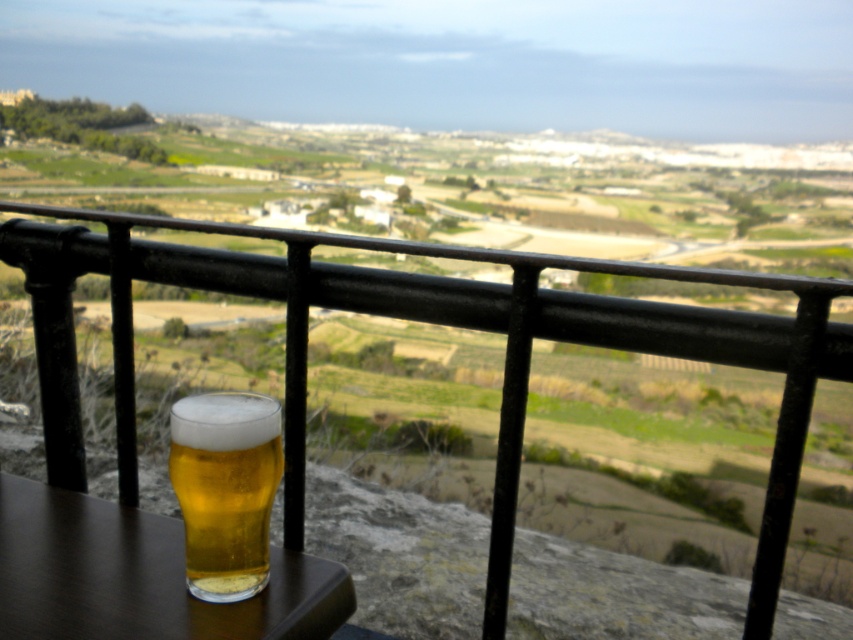
Who is lower down, black metal railing at upper center or golden glass beer at lower left?

golden glass beer at lower left is lower down.

Does black metal railing at upper center have a larger size compared to golden glass beer at lower left?

Yes, black metal railing at upper center is bigger than golden glass beer at lower left.

Who is more forward, (77, 212) or (189, 433)?

Point (189, 433) is in front.

The width and height of the screenshot is (853, 640). I want to click on black metal railing at upper center, so click(422, 321).

Does brown wood table at lower left have a greater height compared to golden glass beer at lower left?

No, brown wood table at lower left is not taller than golden glass beer at lower left.

Does point (10, 600) lie behind point (245, 509)?

Yes, it is.

This screenshot has height=640, width=853. What are the coordinates of `brown wood table at lower left` in the screenshot? It's located at (138, 577).

Which is more to the left, black metal railing at upper center or brown wood table at lower left?

brown wood table at lower left

Is black metal railing at upper center positioned in front of brown wood table at lower left?

No, it is not.

The height and width of the screenshot is (640, 853). I want to click on black metal railing at upper center, so click(x=422, y=321).

At what (x,y) coordinates should I click in order to perform the action: click on black metal railing at upper center. Please return your answer as a coordinate pair (x, y). This screenshot has width=853, height=640. Looking at the image, I should click on (422, 321).